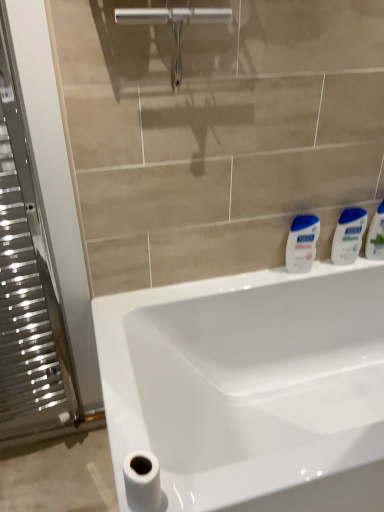
Question: Considering their positions, is white matte toilet paper at lower left located in front of or behind silver metallic radiator at left?

Choices:
 (A) front
 (B) behind

Answer: (A)

Question: Is white matte toilet paper at lower left wider or thinner than silver metallic radiator at left?

Choices:
 (A) thin
 (B) wide

Answer: (A)

Question: Considering the real-world distances, which object is farthest from the white matte toilet paper at lower left?

Choices:
 (A) silver metallic radiator at left
 (B) white glossy lotion at right
 (C) white glossy lotion at right, the 1th toiletry in the right-to-left sequence
 (D) silver metallic tap at upper center
 (E) white glossy sink at center

Answer: (C)

Question: Which of these objects is positioned closest to the silver metallic radiator at left?

Choices:
 (A) silver metallic tap at upper center
 (B) white glossy lotion at right, arranged as the first toiletry when viewed from the left
 (C) white glossy lotion at right, which is counted as the second toiletry, starting from the left
 (D) white matte toilet paper at lower left
 (E) white glossy lotion at right

Answer: (D)